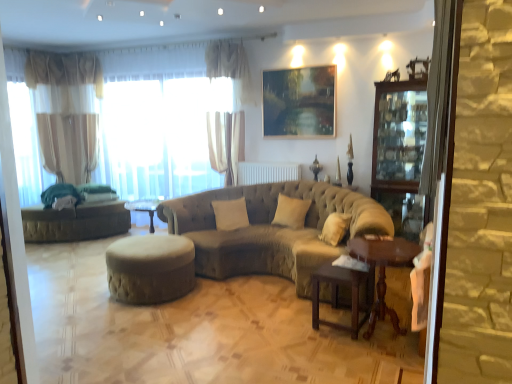
What do you see at coordinates (75, 222) in the screenshot? The height and width of the screenshot is (384, 512). I see `velvet brown footrest at left` at bounding box center [75, 222].

What do you see at coordinates (267, 172) in the screenshot? I see `white plastic radiator at center` at bounding box center [267, 172].

What do you see at coordinates (291, 212) in the screenshot? The height and width of the screenshot is (384, 512). I see `beige fabric pillow at center, placed as the 1th pillow when sorted from right to left` at bounding box center [291, 212].

This screenshot has height=384, width=512. What are the coordinates of `beige fabric pillow at center, arranged as the 2th pillow when viewed from the right` in the screenshot? It's located at (230, 214).

Looking at their sizes, would you say stone textured screen door at right is wider or thinner than velvet beige stool at center?

In the image, stone textured screen door at right appears to be more narrow than velvet beige stool at center.

Which of these two, stone textured screen door at right or velvet beige stool at center, stands shorter?

velvet beige stool at center is shorter.

Looking at this image, from the image's perspective, is stone textured screen door at right located beneath velvet beige stool at center?

Actually, stone textured screen door at right appears above velvet beige stool at center in the image.

In the scene shown: Choose the correct answer: Is stone textured screen door at right inside velvet beige stool at center or outside it?

stone textured screen door at right is not inside velvet beige stool at center, it's outside.

Consider the image. Is beige fabric pillow at center, arranged as the 2th pillow when viewed from the left, smaller than tufted fabric couch at center?

Indeed, beige fabric pillow at center, arranged as the 2th pillow when viewed from the left, has a smaller size compared to tufted fabric couch at center.

Choose the correct answer: Is beige fabric pillow at center, arranged as the 2th pillow when viewed from the left, inside tufted fabric couch at center or outside it?

beige fabric pillow at center, arranged as the 2th pillow when viewed from the left, is enclosed within tufted fabric couch at center.

What's the angular difference between beige fabric pillow at center, placed as the 1th pillow when sorted from right to left, and tufted fabric couch at center's facing directions?

The angular difference between beige fabric pillow at center, placed as the 1th pillow when sorted from right to left, and tufted fabric couch at center is 2.19 degrees.

Is point (300, 206) less distant than point (356, 228)?

That is False.

What's the angular difference between sheer fabric curtain at left, positioned as the first curtain in left-to-right order, and translucent fabric at left's facing directions?

89.7 degrees.

Considering the sizes of sheer fabric curtain at left, marked as the 1th curtain in a back-to-front arrangement, and translucent fabric at left in the image, is sheer fabric curtain at left, marked as the 1th curtain in a back-to-front arrangement, wider or thinner than translucent fabric at left?

In the image, sheer fabric curtain at left, marked as the 1th curtain in a back-to-front arrangement, appears to be more narrow than translucent fabric at left.

Which is behind, sheer fabric curtain at left, arranged as the second curtain when viewed from the right, or translucent fabric at left?

Positioned behind is sheer fabric curtain at left, arranged as the second curtain when viewed from the right.

Would you say sheer fabric curtain at left, which is the second curtain in front-to-back order, contains translucent fabric at left?

No, translucent fabric at left is not surrounded by sheer fabric curtain at left, which is the second curtain in front-to-back order.

Which is more to the left, tufted fabric couch at center or metallic painting at upper center?

Positioned to the left is tufted fabric couch at center.

Is tufted fabric couch at center not within metallic painting at upper center?

Yes, tufted fabric couch at center is outside of metallic painting at upper center.

Can you tell me how much tufted fabric couch at center and metallic painting at upper center differ in facing direction?

A: 4.62 degrees separate the facing orientations of tufted fabric couch at center and metallic painting at upper center.

Considering the relative positions of tufted fabric couch at center and metallic painting at upper center in the image provided, is tufted fabric couch at center behind metallic painting at upper center?

No, tufted fabric couch at center is closer to the camera.

From a real-world perspective, starting from the translucent fabric at left, which table is the 1st one below it? Please provide its 2D coordinates.

[(383, 271)]

In terms of size, does translucent fabric at left appear bigger or smaller than wooden polished table at lower right, the 1th table when ordered from right to left?

In the image, translucent fabric at left appears to be larger than wooden polished table at lower right, the 1th table when ordered from right to left.

Can you tell me how much translucent fabric at left and wooden polished table at lower right, the second table viewed from the left, differ in facing direction?

93.3 degrees.

Does translucent fabric at left have a greater width compared to wooden polished table at lower right, the 1th table when ordered from right to left?

Incorrect, the width of translucent fabric at left does not surpass that of wooden polished table at lower right, the 1th table when ordered from right to left.

Is velvet brown footrest at left wider or thinner than transparent glass cabinet at right?

In the image, velvet brown footrest at left appears to be wider than transparent glass cabinet at right.

Is velvet brown footrest at left positioned with its back to transparent glass cabinet at right?

No, transparent glass cabinet at right is not at the back of velvet brown footrest at left.

Between point (93, 221) and point (397, 185), which one is positioned behind?

The point (93, 221) is farther from the camera.

From a real-world perspective, does velvet brown footrest at left sit lower than transparent glass cabinet at right?

Yes, from a real-world perspective, velvet brown footrest at left is below transparent glass cabinet at right.

Do you think beige fabric pillow at center, placed as the 1th pillow when sorted from right to left, is within wooden polished table at lower right, the second table viewed from the left, or outside of it?

beige fabric pillow at center, placed as the 1th pillow when sorted from right to left, is outside wooden polished table at lower right, the second table viewed from the left.

Which of these two, beige fabric pillow at center, arranged as the 2th pillow when viewed from the left, or wooden polished table at lower right, the second table viewed from the left, is smaller?

With smaller size is beige fabric pillow at center, arranged as the 2th pillow when viewed from the left.

The image size is (512, 384). In order to click on pillow that is the 1st object to the left of the wooden polished table at lower right, the 1th table when ordered from right to left, starting at the anchor in this screenshot , I will do `click(291, 212)`.

Between beige fabric pillow at center, arranged as the 2th pillow when viewed from the left, and wooden polished table at lower right, the 1th table when ordered from right to left, which one is positioned in front?

Positioned in front is wooden polished table at lower right, the 1th table when ordered from right to left.

The image size is (512, 384). Find the location of `screen door that is in front of the velvet beige stool at center`. screen door that is in front of the velvet beige stool at center is located at coordinates (440, 159).

I want to click on studio couch that is on the left side of beige fabric pillow at center, arranged as the 2th pillow when viewed from the left, so click(271, 230).

Estimate the real-world distances between objects in this image. Which object is closer to sheer fabric curtain at upper center, placed as the 2th curtain when sorted from left to right, tufted fabric couch at center or translucent fabric at left?

translucent fabric at left lies closer to sheer fabric curtain at upper center, placed as the 2th curtain when sorted from left to right, than the other object.

Estimate the real-world distances between objects in this image. Which object is further from wooden polished table at lower right, the second table viewed from the left, brown wooden table at lower right, the 1th table positioned from the left, or beige fabric pillow at center, which is the 1th pillow in left-to-right order?

The object further to wooden polished table at lower right, the second table viewed from the left, is beige fabric pillow at center, which is the 1th pillow in left-to-right order.

Based on their spatial positions, is metallic painting at upper center or wooden polished table at lower right, the second table viewed from the left, closer to sheer fabric curtain at upper center, positioned as the first curtain in right-to-left order?

Based on the image, metallic painting at upper center appears to be nearer to sheer fabric curtain at upper center, positioned as the first curtain in right-to-left order.

Which object lies nearer to the anchor point white plastic radiator at center, sheer fabric curtain at upper center, arranged as the first curtain when viewed from the front, or tufted fabric couch at center?

The object closer to white plastic radiator at center is sheer fabric curtain at upper center, arranged as the first curtain when viewed from the front.

Considering their positions, is velvet beige stool at center positioned closer to velvet brown footrest at left than white plastic radiator at center?

velvet beige stool at center lies closer to velvet brown footrest at left than the other object.

Which object lies nearer to the anchor point velvet brown footrest at left, sheer fabric curtain at left, arranged as the second curtain when viewed from the right, or beige fabric pillow at center, which is the 1th pillow in left-to-right order?

sheer fabric curtain at left, arranged as the second curtain when viewed from the right, is closer to velvet brown footrest at left.

Which object lies nearer to the anchor point velvet brown footrest at left, brown wooden table at lower right, which is the 2th table from right to left, or velvet beige stool at center?

velvet beige stool at center is closer to velvet brown footrest at left.

Based on their spatial positions, is transparent glass cabinet at right or sheer fabric curtain at left, which is the second curtain in front-to-back order, further from velvet beige stool at center?

sheer fabric curtain at left, which is the second curtain in front-to-back order.

Where is `window screen between velvet brown footrest at left and metallic painting at upper center in the horizontal direction`? This screenshot has width=512, height=384. window screen between velvet brown footrest at left and metallic painting at upper center in the horizontal direction is located at coordinates (159, 136).

Locate an element on the screen. This screenshot has height=384, width=512. stool located between stone textured screen door at right and beige fabric pillow at center, placed as the 1th pillow when sorted from right to left, in the depth direction is located at coordinates (150, 268).

Where is `stool positioned between stone textured screen door at right and metallic painting at upper center from near to far`? The image size is (512, 384). stool positioned between stone textured screen door at right and metallic painting at upper center from near to far is located at coordinates (150, 268).

The width and height of the screenshot is (512, 384). In order to click on radiator located between tufted fabric couch at center and translucent fabric at left in the depth direction in this screenshot , I will do `click(267, 172)`.